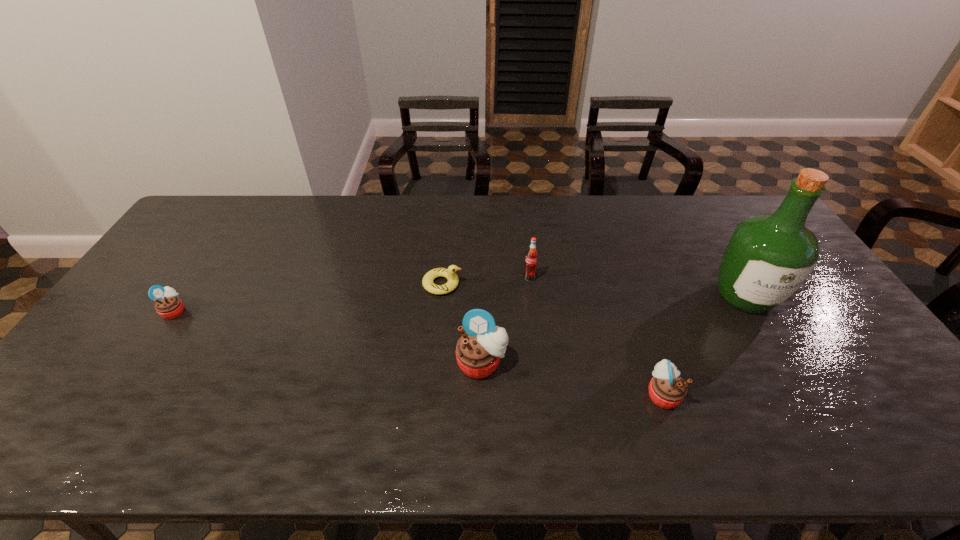
In the image, there is a desktop. At what (x,y) coordinates should I click in order to perform the action: click on vacant space at the near left corner. Please return your answer as a coordinate pair (x, y). The height and width of the screenshot is (540, 960). Looking at the image, I should click on (53, 410).

Where is `free spot between the shortest muffin and the second object from right to left`? free spot between the shortest muffin and the second object from right to left is located at coordinates pos(419,353).

What are the coordinates of `free space between the soda bottle and the shortest object` in the screenshot? It's located at (486, 281).

Where is `vacant area between the second shortest muffin and the tallest object`? The width and height of the screenshot is (960, 540). vacant area between the second shortest muffin and the tallest object is located at coordinates (704, 346).

The image size is (960, 540). I want to click on vacant space in between the duckling and the tallest muffin, so click(x=462, y=323).

Find the location of `free space between the rightmost object and the shortest object`. free space between the rightmost object and the shortest object is located at coordinates (593, 291).

This screenshot has height=540, width=960. I want to click on free point between the second tallest muffin and the shortest object, so click(553, 339).

This screenshot has width=960, height=540. What are the coordinates of `free space between the shortest object and the tallest muffin` in the screenshot? It's located at click(x=462, y=323).

Where is `empty space between the second muffin from right to left and the duckling`? empty space between the second muffin from right to left and the duckling is located at coordinates (462, 323).

I want to click on free point between the duckling and the third shortest object, so click(x=553, y=339).